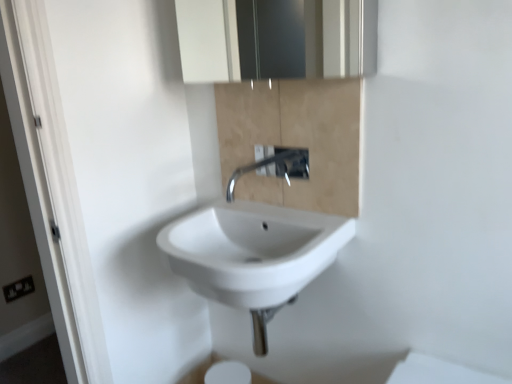
Question: Can you confirm if beige marble cabinet at center is positioned to the right of satin chrome faucet at center?

Choices:
 (A) no
 (B) yes

Answer: (B)

Question: Is beige marble cabinet at center wider than satin chrome faucet at center?

Choices:
 (A) no
 (B) yes

Answer: (A)

Question: Can you confirm if beige marble cabinet at center is shorter than satin chrome faucet at center?

Choices:
 (A) no
 (B) yes

Answer: (A)

Question: Does beige marble cabinet at center have a larger size compared to satin chrome faucet at center?

Choices:
 (A) no
 (B) yes

Answer: (A)

Question: Considering the relative sizes of beige marble cabinet at center and satin chrome faucet at center in the image provided, is beige marble cabinet at center taller than satin chrome faucet at center?

Choices:
 (A) yes
 (B) no

Answer: (A)

Question: Is beige marble cabinet at center positioned beyond the bounds of satin chrome faucet at center?

Choices:
 (A) no
 (B) yes

Answer: (B)

Question: Is white glossy sink at center oriented towards black plastic electrical outlet at lower left?

Choices:
 (A) no
 (B) yes

Answer: (A)

Question: Considering the relative sizes of white glossy sink at center and black plastic electrical outlet at lower left in the image provided, is white glossy sink at center taller than black plastic electrical outlet at lower left?

Choices:
 (A) no
 (B) yes

Answer: (B)

Question: Is white glossy sink at center closer to camera compared to black plastic electrical outlet at lower left?

Choices:
 (A) no
 (B) yes

Answer: (B)

Question: From the image's perspective, does white glossy sink at center appear higher than black plastic electrical outlet at lower left?

Choices:
 (A) no
 (B) yes

Answer: (B)

Question: Is white glossy sink at center not close to black plastic electrical outlet at lower left?

Choices:
 (A) yes
 (B) no

Answer: (A)

Question: From the image's perspective, would you say white glossy sink at center is shown under black plastic electrical outlet at lower left?

Choices:
 (A) yes
 (B) no

Answer: (B)

Question: Does black plastic electrical outlet at lower left have a smaller size compared to satin chrome faucet at center?

Choices:
 (A) yes
 (B) no

Answer: (A)